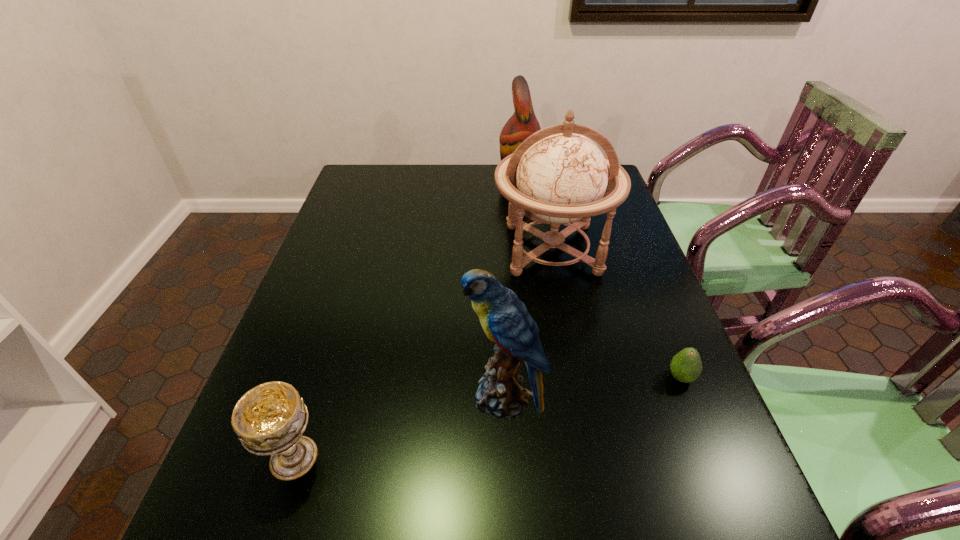
Identify the location of vacant space located on the face of the farther parrot. (409, 178).

The height and width of the screenshot is (540, 960). Identify the location of vacant region located 0.230m on the face of the farther parrot. (434, 178).

You are a GUI agent. You are given a task and a screenshot of the screen. Output one action in this format:
    pyautogui.click(x=<x>, y=<y>)
    Task: Click on the vacant space situated 0.320m on the face of the nearer parrot
    The height and width of the screenshot is (540, 960).
    Given the screenshot: What is the action you would take?
    pyautogui.click(x=310, y=397)

The width and height of the screenshot is (960, 540). What are the coordinates of `vacant area located on the face of the nearer parrot` in the screenshot? It's located at (286, 397).

The height and width of the screenshot is (540, 960). I want to click on vacant space situated 0.170m on the face of the nearer parrot, so click(x=383, y=397).

Identify the location of vacant space located on the right of the nearest object. (513, 458).

In order to click on vacant area situated 0.210m on the back of the avocado in this screenshot , I will do `click(649, 299)`.

Image resolution: width=960 pixels, height=540 pixels. What are the coordinates of `object that is at the far edge` in the screenshot? It's located at point(523,123).

Locate an element on the screen. Image resolution: width=960 pixels, height=540 pixels. object located in the left edge section of the desktop is located at coordinates (269, 419).

You are a GUI agent. You are given a task and a screenshot of the screen. Output one action in this format:
    pyautogui.click(x=<x>, y=<y>)
    Task: Click on the globe positioned at the right edge
    
    Given the screenshot: What is the action you would take?
    pyautogui.click(x=556, y=176)